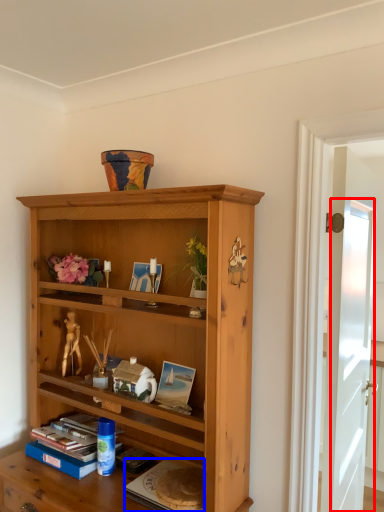
Question: Which of the following is the farthest to the observer, glass door (highlighted by a red box) or paperback book (highlighted by a blue box)?

Choices:
 (A) glass door
 (B) paperback book

Answer: (A)